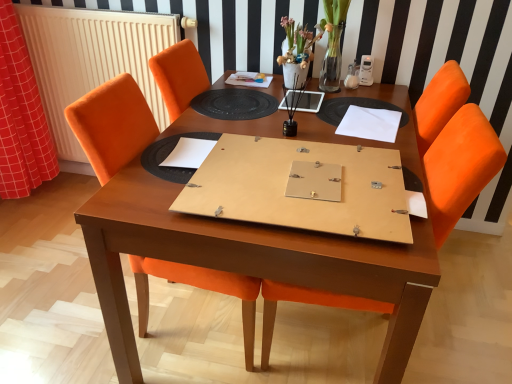
Where is `vacant space in front of black rubber placemat at center`? This screenshot has height=384, width=512. vacant space in front of black rubber placemat at center is located at coordinates (246, 132).